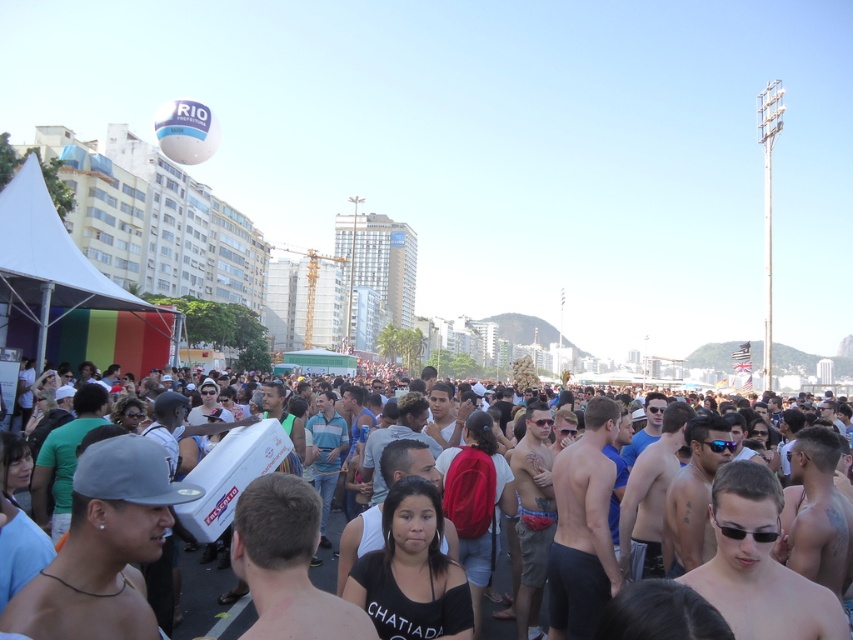
Question: Is shiny skin at center to the left of white matte cooler at center from the viewer's perspective?

Choices:
 (A) no
 (B) yes

Answer: (A)

Question: Is the position of shiny skin at center more distant than that of white matte cooler at center?

Choices:
 (A) no
 (B) yes

Answer: (A)

Question: Can you confirm if shiny skin at center is thinner than white matte cooler at center?

Choices:
 (A) no
 (B) yes

Answer: (B)

Question: Which object is farther from the camera taking this photo?

Choices:
 (A) shiny skin at center
 (B) white matte cooler at center

Answer: (B)

Question: Among these objects, which one is farthest from the camera?

Choices:
 (A) shiny skin at center
 (B) white matte cooler at center

Answer: (B)

Question: Which of the following is the closest to the observer?

Choices:
 (A) (778, 531)
 (B) (202, 586)

Answer: (A)